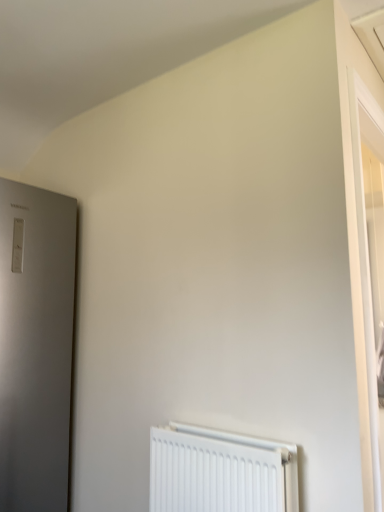
Locate an element on the screen. white plastic radiator at lower center is located at coordinates (220, 472).

The height and width of the screenshot is (512, 384). Describe the element at coordinates (220, 472) in the screenshot. I see `white plastic radiator at lower center` at that location.

In order to face white plastic radiator at lower center, should I rotate leftwards or rightwards?

You should rotate right by 3.985 degrees.

The image size is (384, 512). Identify the location of white plastic radiator at lower center. (220, 472).